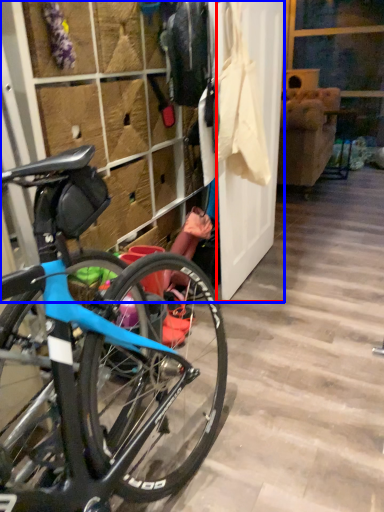
Question: Which of the following is the closest to the observer, screen door (highlighted by a red box) or closet (highlighted by a blue box)?

Choices:
 (A) screen door
 (B) closet

Answer: (B)